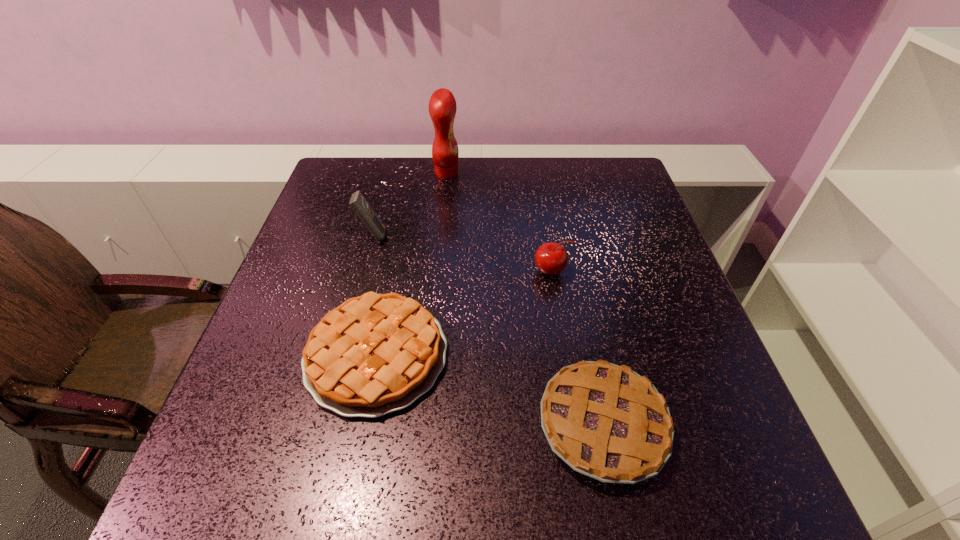
Identify the location of vacant space located 0.120m on the right of the cherry. coord(624,272).

Find the location of `free space located on the right of the left pie`. free space located on the right of the left pie is located at coordinates [504, 355].

The height and width of the screenshot is (540, 960). I want to click on vacant area located 0.240m on the back of the right pie, so click(572, 280).

You are a GUI agent. You are given a task and a screenshot of the screen. Output one action in this format:
    pyautogui.click(x=<x>, y=<y>)
    Task: Click on the object at the far edge
    The image size is (960, 540).
    Given the screenshot: What is the action you would take?
    pyautogui.click(x=442, y=106)

This screenshot has width=960, height=540. Find the location of `object positioned at the near edge`. object positioned at the near edge is located at coordinates (606, 421).

In order to click on calculator at the left edge in this screenshot , I will do `click(362, 208)`.

I want to click on pie that is at the left edge, so click(374, 354).

Find the location of `object located in the right edge section of the desktop`. object located in the right edge section of the desktop is located at coordinates (606, 421).

Find the location of `object present at the near right corner`. object present at the near right corner is located at coordinates (606, 421).

Locate an element on the screen. The image size is (960, 540). vacant space at the far edge of the desktop is located at coordinates (479, 165).